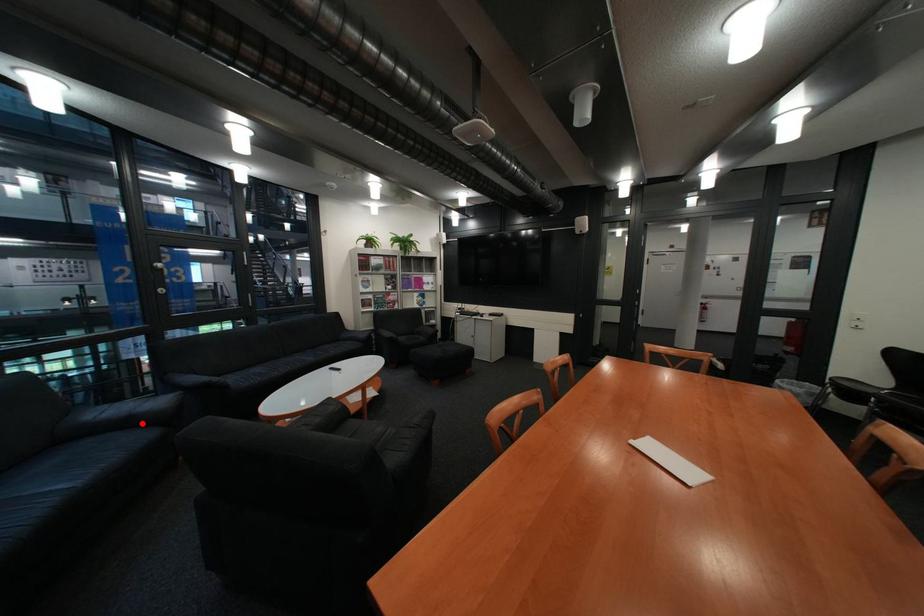
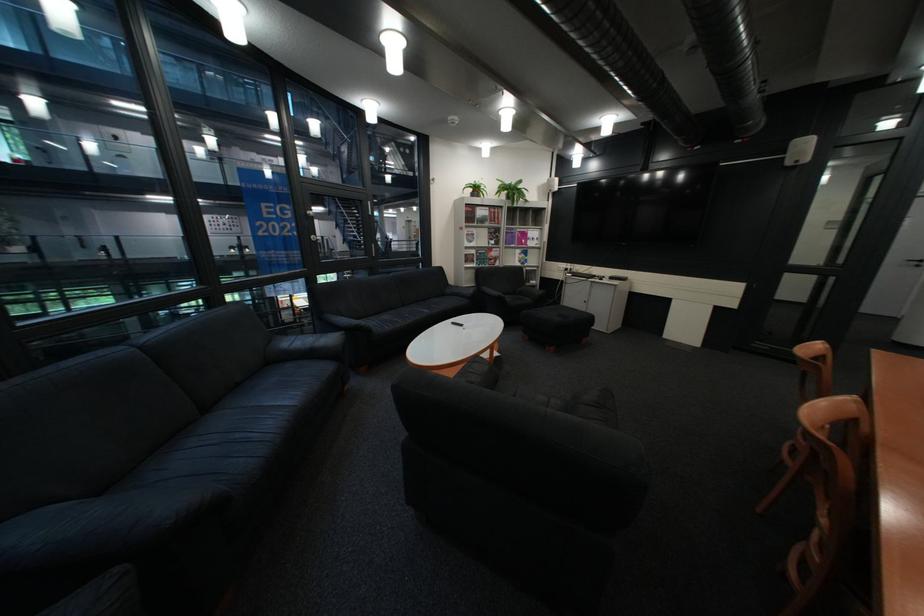
In the second image, find the point that corresponds to the highlighted location in the first image.

(325, 354)